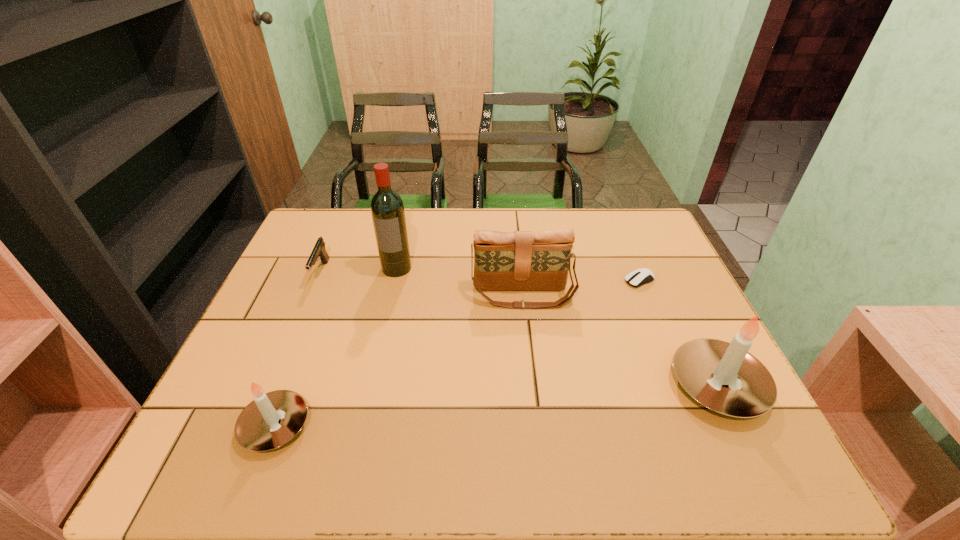
Please point a location where one more candle can be added evenly. Please provide its 2D coordinates. Your answer should be formatted as a tuple, i.e. [(x, y)], where the tuple contains the x and y coordinates of a point satisfying the conditions above.

[(505, 405)]